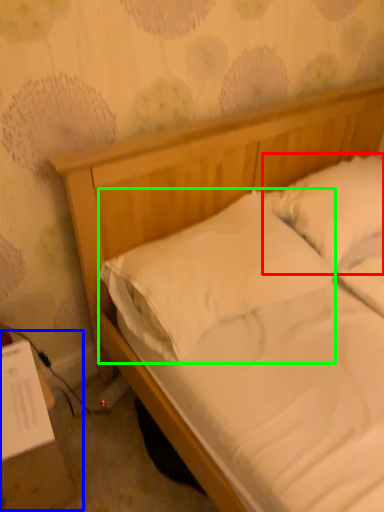
Question: Which object is the closest to the pillow (highlighted by a red box)? Choose among these: table (highlighted by a blue box) or pillow (highlighted by a green box).

Choices:
 (A) table
 (B) pillow

Answer: (B)